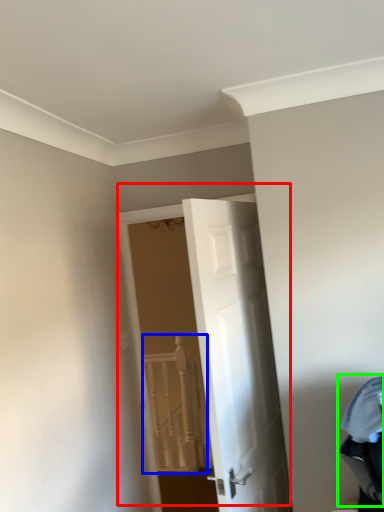
Question: Considering the real-world distances, which object is farthest from door (highlighted by a red box)? rail (highlighted by a blue box) or laundry (highlighted by a green box)?

Choices:
 (A) rail
 (B) laundry

Answer: (A)